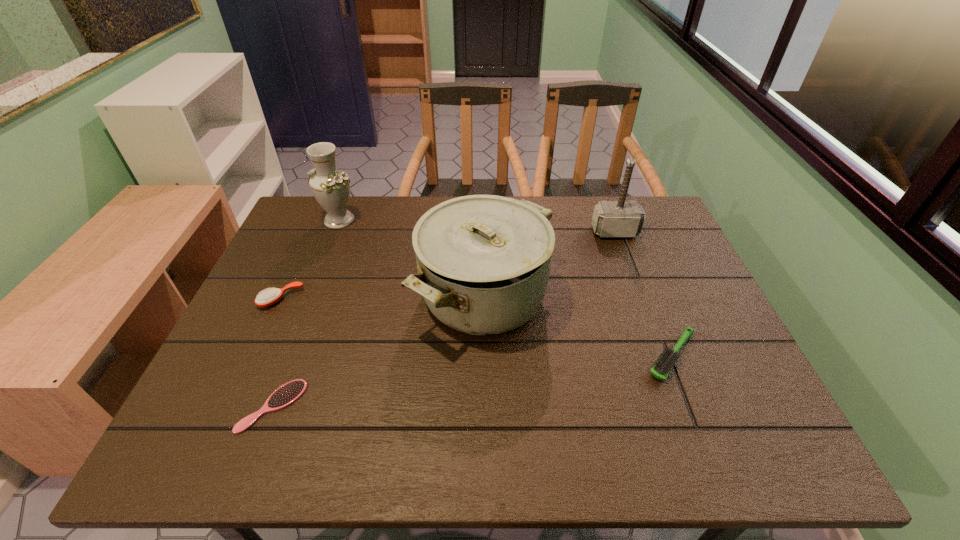
This screenshot has width=960, height=540. I want to click on vase, so click(331, 188).

Locate an element on the screen. The width and height of the screenshot is (960, 540). hammer is located at coordinates (621, 218).

Where is `saucepan`? The height and width of the screenshot is (540, 960). saucepan is located at coordinates (483, 261).

Where is `the farthest hairbrush`? The image size is (960, 540). the farthest hairbrush is located at coordinates (266, 298).

In order to click on the rightmost hairbrush in this screenshot , I will do `click(663, 366)`.

Image resolution: width=960 pixels, height=540 pixels. In order to click on the shortest object in this screenshot , I will do `click(287, 394)`.

This screenshot has width=960, height=540. Find the location of `vacant space located 0.110m on the right of the vase`. vacant space located 0.110m on the right of the vase is located at coordinates (394, 220).

The width and height of the screenshot is (960, 540). Identify the location of vacant space located for striking with the head of the hammer. (629, 271).

At what (x,y) coordinates should I click in order to perform the action: click on free point located on the front of the third object from right to left. Please return your answer as a coordinate pair (x, y). The height and width of the screenshot is (540, 960). Looking at the image, I should click on (484, 375).

At what (x,y) coordinates should I click in order to perform the action: click on vacant space located 0.140m on the front of the farthest hairbrush. Please return your answer as a coordinate pair (x, y). Looking at the image, I should click on (254, 355).